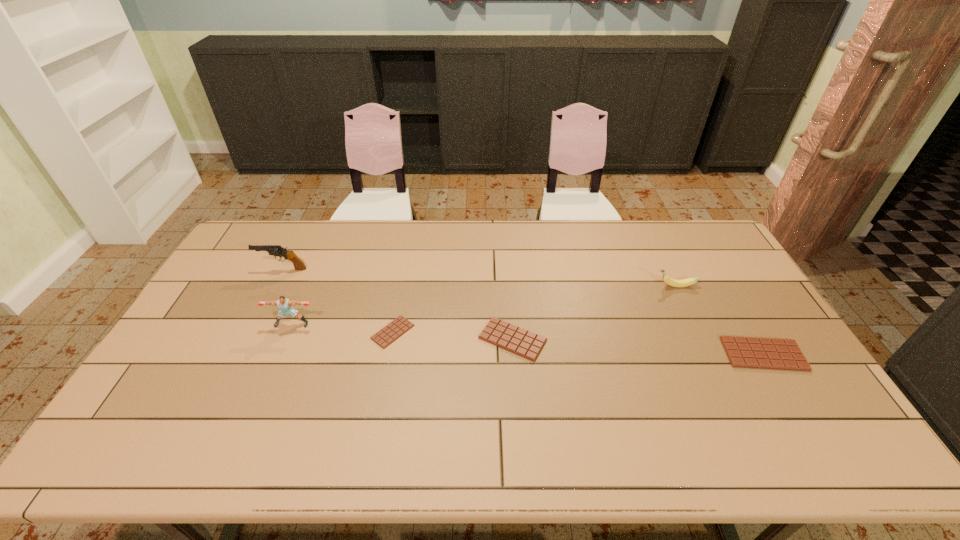
Locate an element on the screen. This screenshot has width=960, height=540. the shortest object is located at coordinates (391, 332).

Image resolution: width=960 pixels, height=540 pixels. Find the location of `the shortest candy bar`. the shortest candy bar is located at coordinates (391, 332).

Where is `the second shortest candy bar`? The height and width of the screenshot is (540, 960). the second shortest candy bar is located at coordinates (524, 343).

The image size is (960, 540). I want to click on the fourth object from left to right, so click(x=524, y=343).

Locate an element on the screen. The image size is (960, 540). the rightmost candy bar is located at coordinates (744, 352).

This screenshot has width=960, height=540. Find the location of `puncher`. puncher is located at coordinates (284, 304).

Identify the location of gun. The image size is (960, 540). (275, 250).

Locate an element on the screen. banana is located at coordinates (669, 281).

At what (x,y) coordinates should I click in order to perform the action: click on the third tallest object. Please return your answer as a coordinate pair (x, y). The image size is (960, 540). Looking at the image, I should click on (669, 281).

The height and width of the screenshot is (540, 960). In order to click on free space located on the right of the shortest candy bar in this screenshot , I will do `click(548, 332)`.